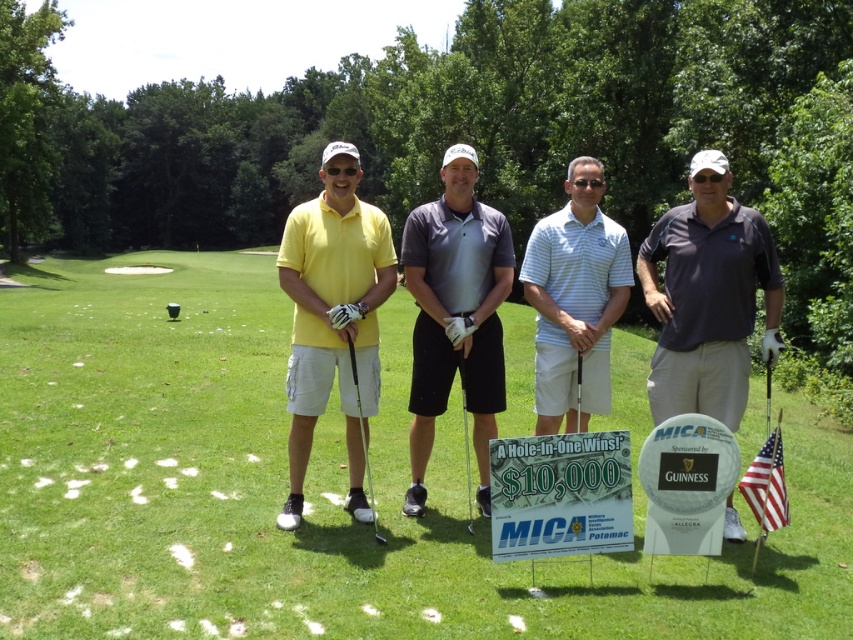
You are a photographer trying to capture a clear shot of the dark gray polo shirt at center and the matte yellow shirt at center. Which participant is positioned lower in the frame?

The dark gray polo shirt at center is positioned lower than the matte yellow shirt at center in the frame.

You are a photographer adjusting the camera settings to ensure all participants are in focus. The dark gray polo shirt at center and the light blue striped polo shirt at center are both in the frame. Which participant should you adjust the focus for to ensure the shorter one is sharp?

The dark gray polo shirt at center is shorter than the light blue striped polo shirt at center, so adjust the focus for the dark gray polo shirt at center to ensure the shorter participant is sharp.